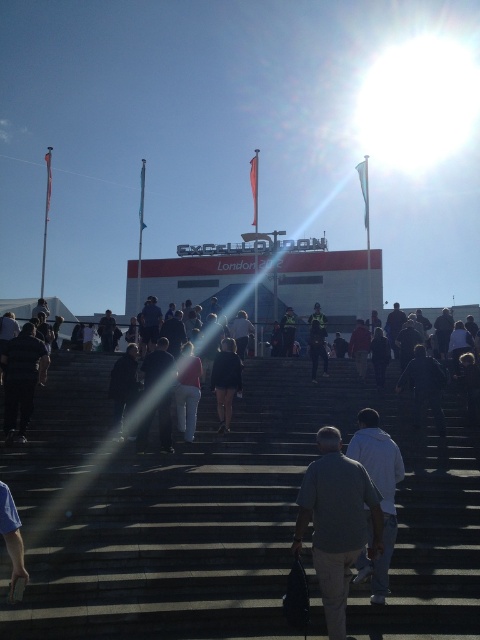
Question: Is gray fabric shirt at center to the right of dark gray fabric jacket at lower left from the viewer's perspective?

Choices:
 (A) yes
 (B) no

Answer: (A)

Question: Which of the following is the closest to the observer?

Choices:
 (A) (175, 461)
 (B) (374, 531)

Answer: (B)

Question: Is dark gray concrete stairs at center wider than dark blue jeans at center?

Choices:
 (A) yes
 (B) no

Answer: (A)

Question: Which object appears closest to the camera in this image?

Choices:
 (A) white hoodie at center
 (B) gray fabric shirt at center
 (C) dark gray fabric jacket at lower left

Answer: (B)

Question: Which object is farther from the camera taking this photo?

Choices:
 (A) dark gray concrete stairs at center
 (B) dark blue jeans at center
 (C) gray fabric shirt at center
 (D) matte red shirt at center

Answer: (B)

Question: Does dark gray concrete stairs at center appear on the right side of dark gray jacket at center?

Choices:
 (A) no
 (B) yes

Answer: (B)